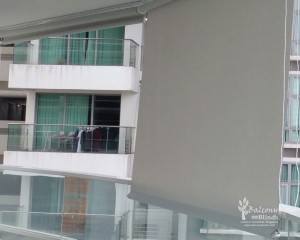
The width and height of the screenshot is (300, 240). I want to click on sliding glass doors, so click(x=79, y=110), click(x=49, y=107), click(x=84, y=46), click(x=57, y=45), click(x=109, y=51), click(x=53, y=194).